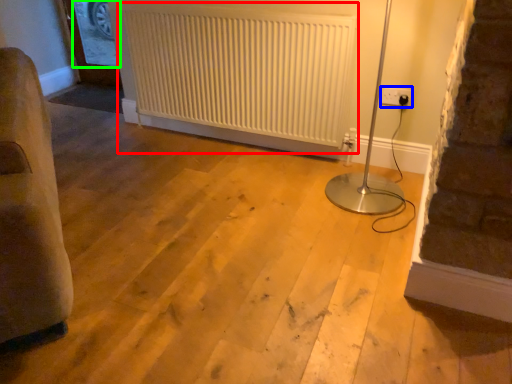
Question: Which object is the closest to the radiator (highlighted by a red box)? Choose among these: electric outlet (highlighted by a blue box) or window screen (highlighted by a green box).

Choices:
 (A) electric outlet
 (B) window screen

Answer: (A)